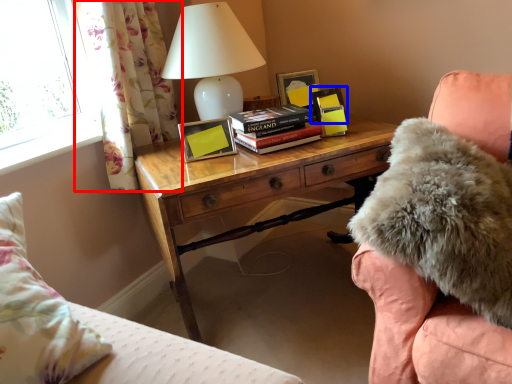
Question: Which object appears farthest to the camera in this image, curtain (highlighted by a red box) or picture frame (highlighted by a blue box)?

Choices:
 (A) curtain
 (B) picture frame

Answer: (B)